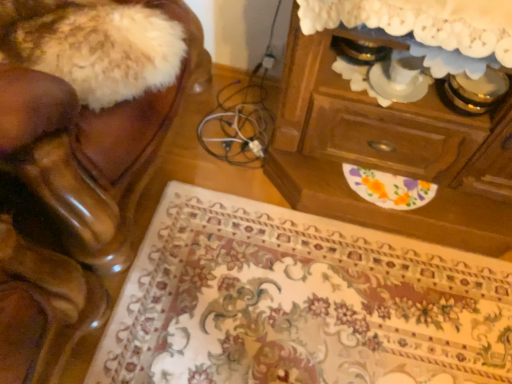
Question: Does shiny brown leather chair at left have a lesser height compared to wooden chest of drawers at upper right?

Choices:
 (A) no
 (B) yes

Answer: (A)

Question: Is shiny brown leather chair at left wider than wooden chest of drawers at upper right?

Choices:
 (A) no
 (B) yes

Answer: (B)

Question: Does shiny brown leather chair at left have a greater height compared to wooden chest of drawers at upper right?

Choices:
 (A) no
 (B) yes

Answer: (B)

Question: Is the depth of shiny brown leather chair at left greater than that of wooden chest of drawers at upper right?

Choices:
 (A) no
 (B) yes

Answer: (A)

Question: Does shiny brown leather chair at left appear on the right side of wooden chest of drawers at upper right?

Choices:
 (A) yes
 (B) no

Answer: (B)

Question: From a real-world perspective, is shiny brown leather chair at left positioned over wooden chest of drawers at upper right based on gravity?

Choices:
 (A) no
 (B) yes

Answer: (B)

Question: Is wooden chest of drawers at upper right not close to floral carpet at lower center?

Choices:
 (A) no
 (B) yes

Answer: (A)

Question: Is wooden chest of drawers at upper right smaller than floral carpet at lower center?

Choices:
 (A) no
 (B) yes

Answer: (A)

Question: Can you see wooden chest of drawers at upper right touching floral carpet at lower center?

Choices:
 (A) no
 (B) yes

Answer: (A)

Question: From the image's perspective, is wooden chest of drawers at upper right located above floral carpet at lower center?

Choices:
 (A) yes
 (B) no

Answer: (A)

Question: Is wooden chest of drawers at upper right surrounding floral carpet at lower center?

Choices:
 (A) yes
 (B) no

Answer: (B)

Question: Is wooden chest of drawers at upper right to the left of floral carpet at lower center from the viewer's perspective?

Choices:
 (A) yes
 (B) no

Answer: (B)

Question: Does wooden chest of drawers at upper right appear on the left side of shiny brown leather chair at left?

Choices:
 (A) no
 (B) yes

Answer: (A)